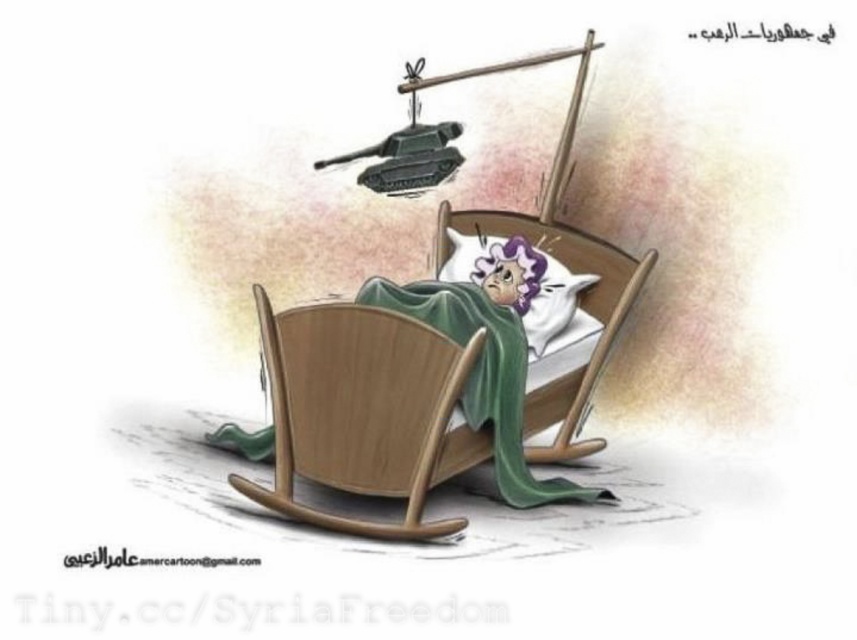
Question: Considering the real-world distances, which object is farthest from the white soft pillow at center?

Choices:
 (A) wooden rocking chair at center
 (B) green soft blanket at center

Answer: (A)

Question: Is wooden rocking chair at center positioned in front of green soft blanket at center?

Choices:
 (A) no
 (B) yes

Answer: (B)

Question: Which is nearer to the white soft pillow at center?

Choices:
 (A) wooden rocking chair at center
 (B) green soft blanket at center

Answer: (B)

Question: Based on their relative distances, which object is nearer to the green soft blanket at center?

Choices:
 (A) wooden rocking chair at center
 (B) white soft pillow at center

Answer: (A)

Question: Considering the relative positions of wooden rocking chair at center and white soft pillow at center in the image provided, where is wooden rocking chair at center located with respect to white soft pillow at center?

Choices:
 (A) right
 (B) left

Answer: (B)

Question: Can you confirm if green soft blanket at center is smaller than white soft pillow at center?

Choices:
 (A) no
 (B) yes

Answer: (A)